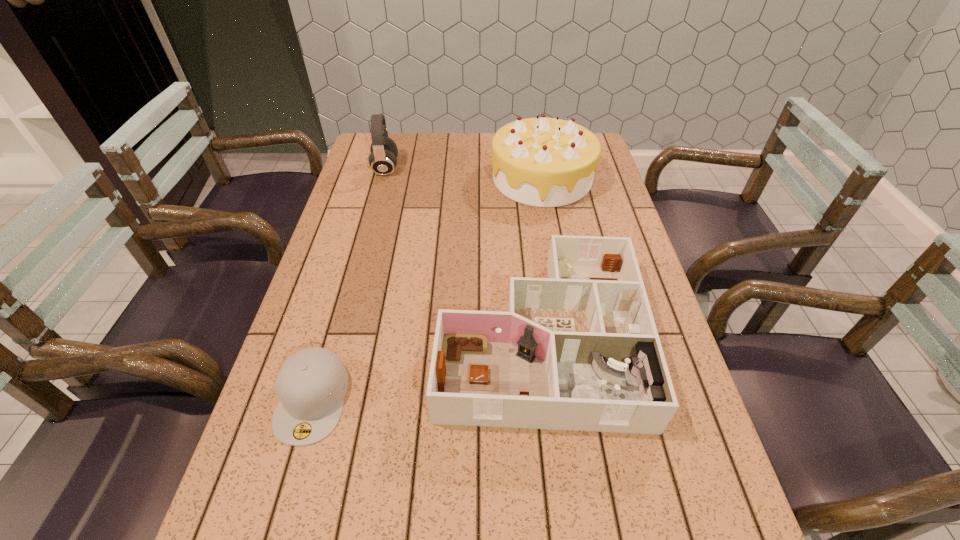
This screenshot has width=960, height=540. What are the coordinates of `headset located in the left edge section of the desktop` in the screenshot? It's located at (383, 159).

In order to click on cap that is at the left edge in this screenshot , I will do `click(311, 384)`.

At what (x,y) coordinates should I click in order to perform the action: click on birthday cake at the right edge. Please return your answer as a coordinate pair (x, y). The image size is (960, 540). Looking at the image, I should click on (544, 162).

You are a GUI agent. You are given a task and a screenshot of the screen. Output one action in this format:
    pyautogui.click(x=<x>, y=<y>)
    Task: Click on the dollhouse that is at the right edge
    This screenshot has height=540, width=960.
    Given the screenshot: What is the action you would take?
    pyautogui.click(x=579, y=350)

Locate an element on the screen. object present at the far left corner is located at coordinates (383, 159).

The height and width of the screenshot is (540, 960). What are the coordinates of `object present at the far right corner` in the screenshot? It's located at (544, 162).

In order to click on vacant space at the far edge in this screenshot , I will do `click(415, 164)`.

The width and height of the screenshot is (960, 540). What are the coordinates of `free point at the left edge` in the screenshot? It's located at (332, 246).

Where is `vacant space at the right edge of the desktop`? Image resolution: width=960 pixels, height=540 pixels. vacant space at the right edge of the desktop is located at coordinates (630, 230).

You are a GUI agent. You are given a task and a screenshot of the screen. Output one action in this format:
    pyautogui.click(x=<x>, y=<y>)
    Task: Click on the free area in between the headset and the third tallest object
    This screenshot has height=540, width=960.
    Given the screenshot: What is the action you would take?
    pyautogui.click(x=463, y=253)